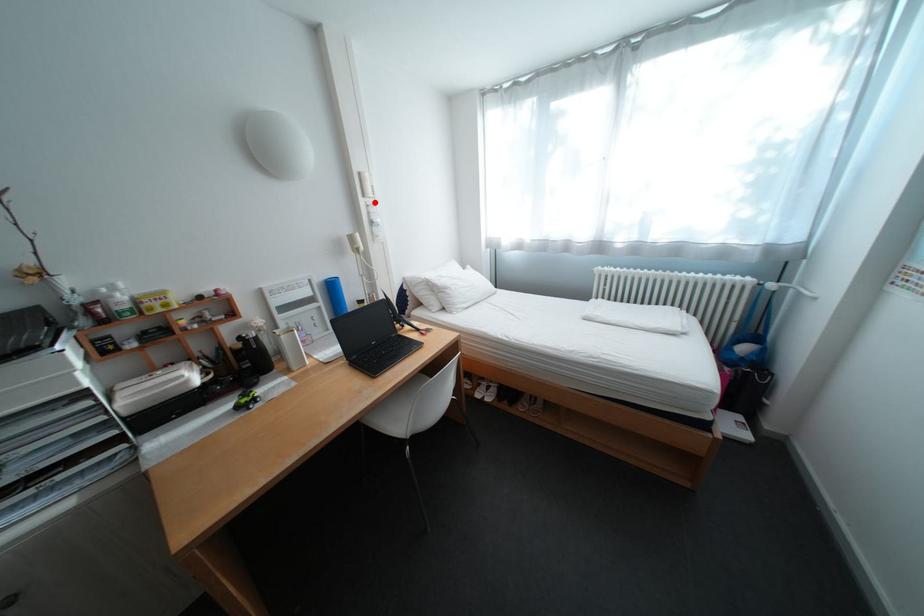
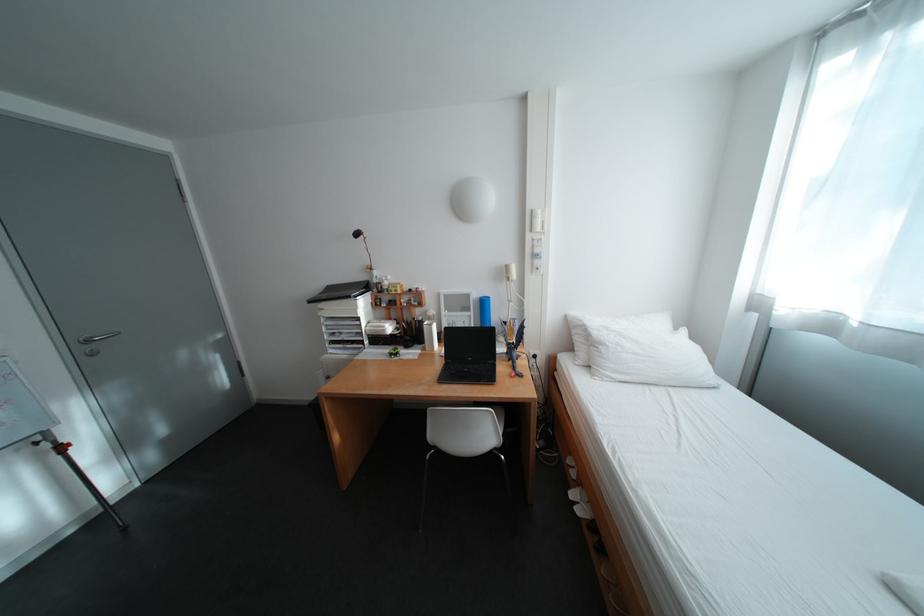
Locate, in the second image, the point that corresponds to the highlighted location in the first image.

(541, 237)